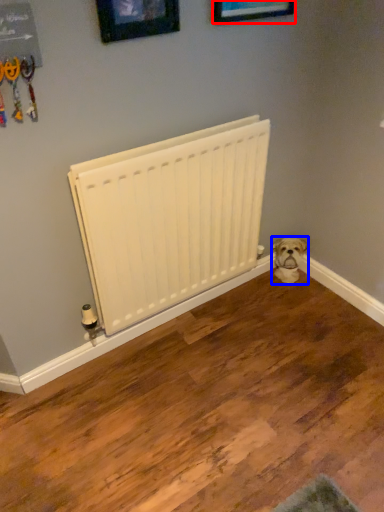
Question: Among these objects, which one is nearest to the camera, picture frame (highlighted by a red box) or dog (highlighted by a blue box)?

Choices:
 (A) picture frame
 (B) dog

Answer: (A)